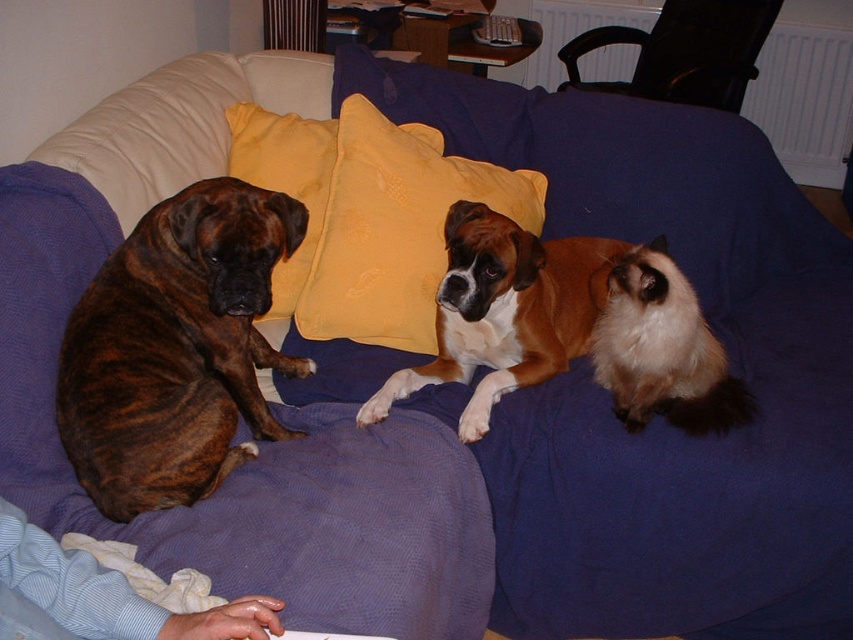
You are trying to place a new decorative item on the couch in the image. The couch has a blue blanket and two yellow pillows. You want to place the item exactly where the yellow fabric pillow at upper center is located. What are the coordinates of that spot?

The coordinates of the yellow fabric pillow at upper center are at point [316,188].

You are a photographer trying to capture a portrait of the brindle fur dog at left and the brown shiny fur dog at center. Since you want to ensure both subjects are in focus, you need to know which one is taller. Can you determine which dog is taller?

The brindle fur dog at left is taller than the brown shiny fur dog at center, so you should adjust your camera settings to accommodate the height difference for proper focus.

You are trying to place a new decorative item on the couch where the yellow fabric pillow at upper center and the black plastic chair at upper right are located. Considering their sizes, which object would require more vertical space?

The yellow fabric pillow at upper center requires more vertical space because it is much taller than the black plastic chair at upper right.